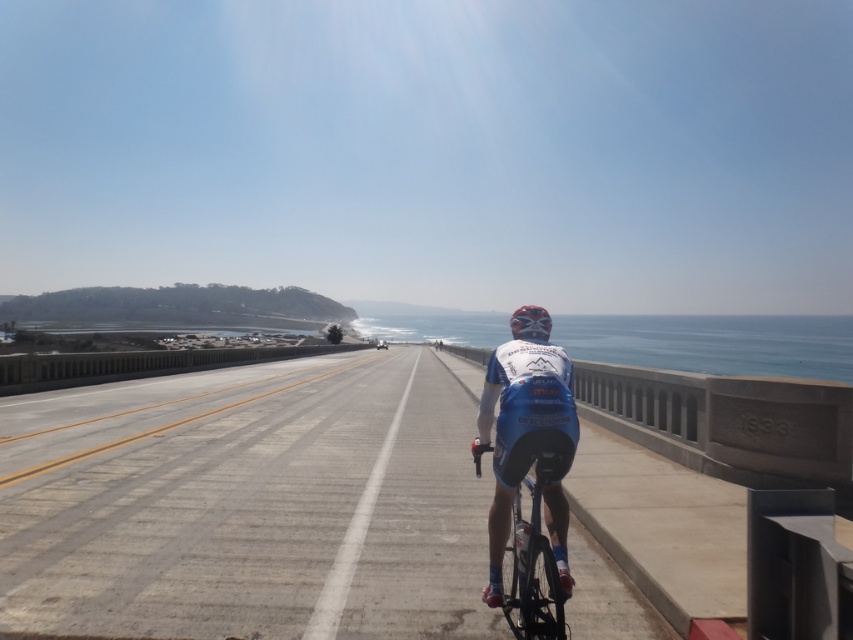
Which of these two, shiny blue frame at center or shiny red helmet at center, stands shorter?

With less height is shiny red helmet at center.

Measure the distance between point (480, 452) and camera.

The distance of point (480, 452) from camera is 3.96 meters.

This screenshot has height=640, width=853. I want to click on shiny blue frame at center, so click(535, 550).

Who is lower down, gray asphalt highway at center or shiny red helmet at center?

gray asphalt highway at center is below.

Is gray asphalt highway at center in front of shiny red helmet at center?

That is True.

Does point (126, 435) come in front of point (531, 307)?

No, (126, 435) is further to viewer.

Identify the location of gray asphalt highway at center. The image size is (853, 640). (248, 506).

Does blue fabric jersey at center appear on the left side of shiny blue frame at center?

Correct, you'll find blue fabric jersey at center to the left of shiny blue frame at center.

The height and width of the screenshot is (640, 853). Describe the element at coordinates (526, 442) in the screenshot. I see `blue fabric jersey at center` at that location.

Image resolution: width=853 pixels, height=640 pixels. Describe the element at coordinates (526, 442) in the screenshot. I see `blue fabric jersey at center` at that location.

The height and width of the screenshot is (640, 853). I want to click on blue fabric jersey at center, so click(526, 442).